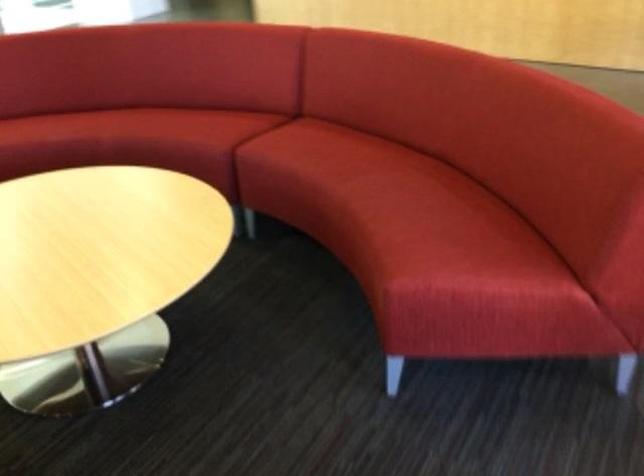
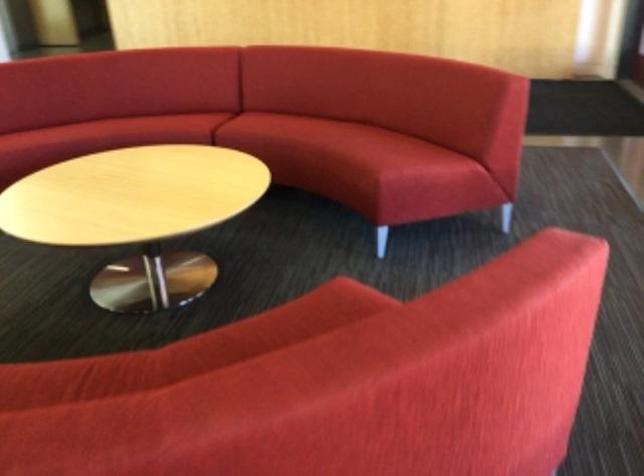
The images are taken continuously from a first-person perspective. In which direction are you moving?

The movement direction of the cameraman is left, backward.